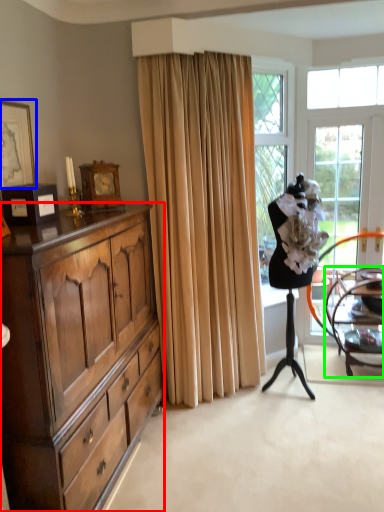
Question: Estimate the real-world distances between objects in this image. Which object is closer to cabinetry (highlighted by a red box), picture frame (highlighted by a blue box) or chair (highlighted by a green box)?

Choices:
 (A) picture frame
 (B) chair

Answer: (A)